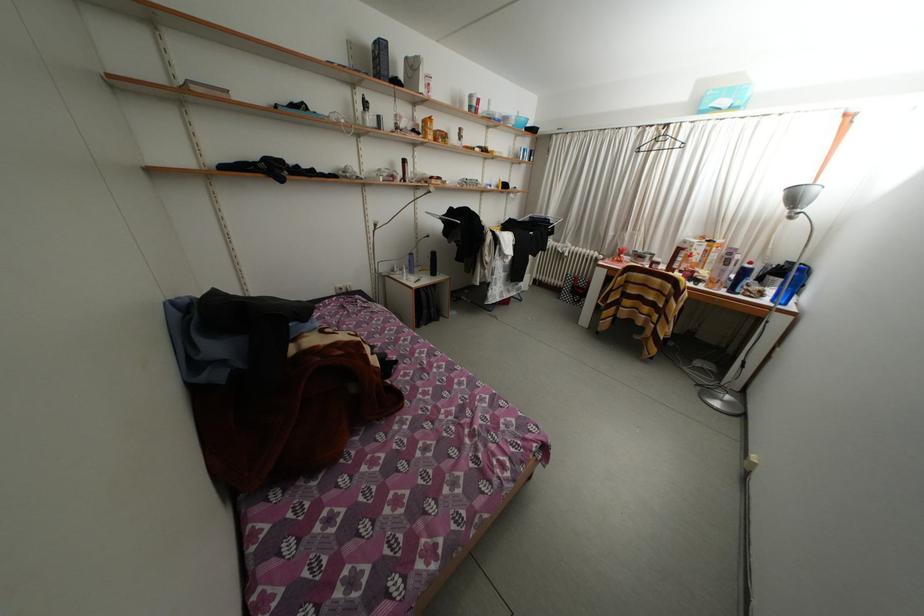
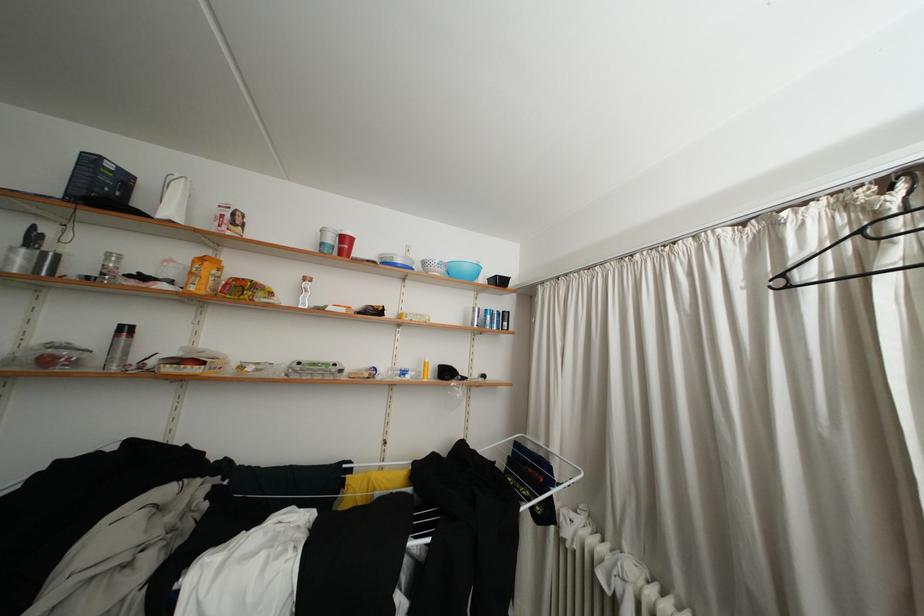
In the second image, find the point that corresponds to (x=479, y=111) in the first image.

(330, 249)